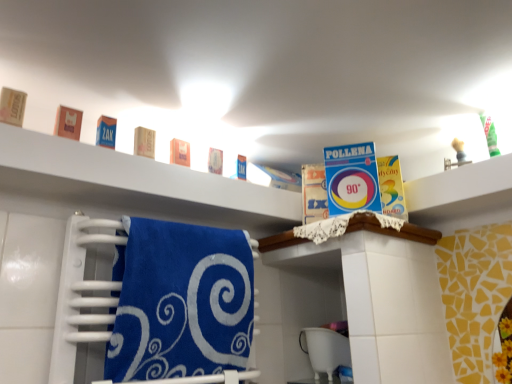
Question: From the image's perspective, is yellow cardboard box at upper right, which appears as the first product when viewed from the right, above or below matte brown soap at left, the 7th product from the right?

Choices:
 (A) above
 (B) below

Answer: (B)

Question: Is yellow cardboard box at upper right, which appears as the first product when viewed from the right, bigger or smaller than matte brown soap at left, the first product when ordered from left to right?

Choices:
 (A) small
 (B) big

Answer: (B)

Question: Estimate the real-world distances between objects in this image. Which object is farther from the blue cardboard box at upper left, which is the third product from left to right?

Choices:
 (A) matte orange soap at center, arranged as the 5th product when viewed from the left
 (B) orange matte box at upper left, which is the 2th product in left-to-right order
 (C) matte brown soap at upper center, the fourth product in the right-to-left sequence
 (D) white matte shelf at upper center, which ranks as the first shelf in left-to-right order
 (E) matte brown soap at left, the 7th product from the right

Answer: (D)

Question: Based on their relative distances, which object is nearer to the blue cardboard box at upper left, which is the third product from left to right?

Choices:
 (A) white plastic bucket at lower center
 (B) matte orange soap at center, the 3th product from the right
 (C) yellow cardboard box at upper right, which appears as the first product when viewed from the right
 (D) satin blue towel at lower left
 (E) white matte shelf at upper center, the 2th shelf from the right

Answer: (B)